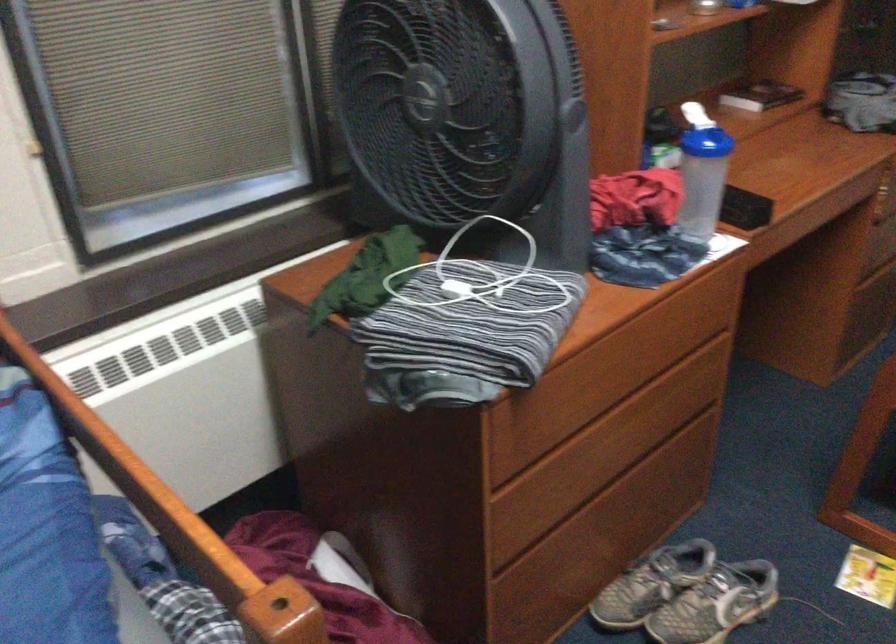
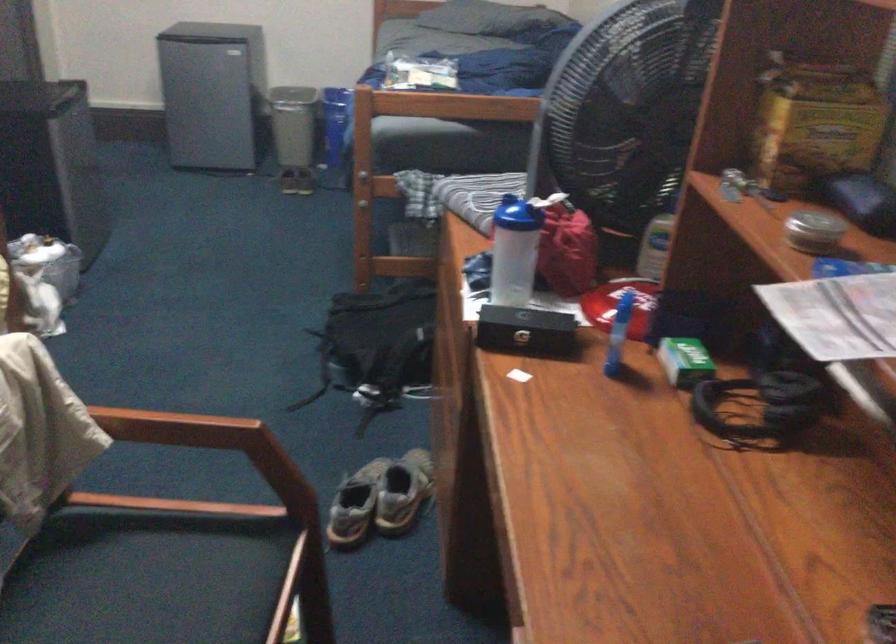
The point at (704, 172) is marked in the first image. Where is the corresponding point in the second image?

(513, 251)